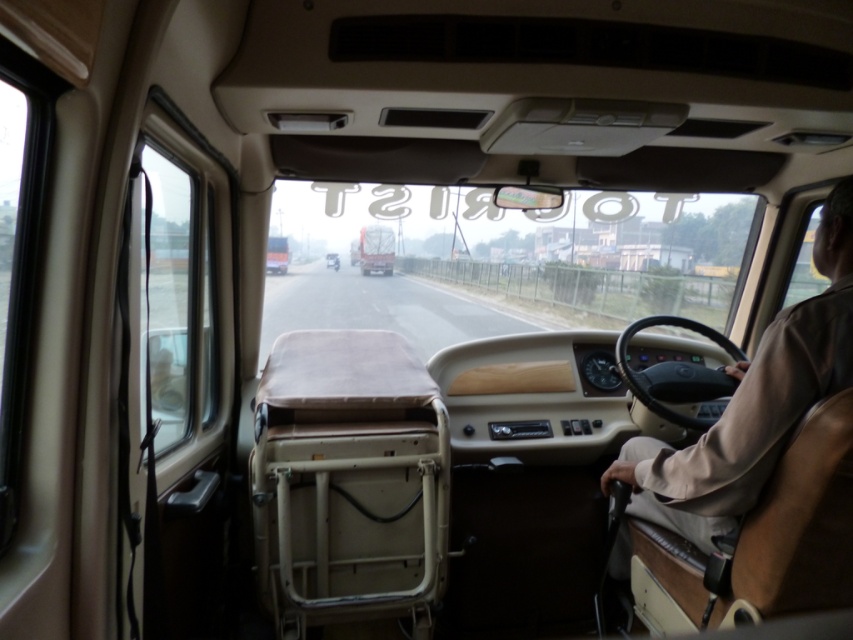
You are a passenger in the vehicle and notice two items in your view. One is the beige fabric shirt at right and the other is the metallic silver car at center. Which item appears bigger in size?

The beige fabric shirt at right appears bigger in size compared to the metallic silver car at center because it has a larger size.

You are a delivery person who needs to place a package on the beige fabric shirt at right and the metallic silver car at center. The package requires a minimum of 10 meters of space between them to avoid interference. Can you safely place them as required?

The beige fabric shirt at right and metallic silver car at center are 9.96 meters apart, which is less than the required 10 meters. Therefore, placing the package between them would not meet the safety requirement.

You are sitting in the passenger seat of the vehicle and want to reach two points marked on the windshield. The first point is at coordinate point(718,451) and the second is at point(334,268). Which point is closer to your face?

Point(718,451) is closer to the viewer than point(334,268), so the first point is closer to your face.